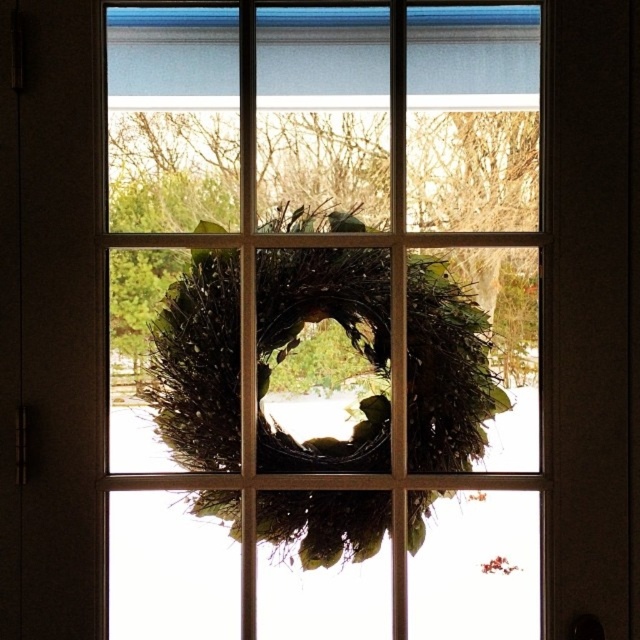
Question: Is green twig wreath at center bigger than green textured wreath at center?

Choices:
 (A) yes
 (B) no

Answer: (A)

Question: Does green twig wreath at center appear on the left side of green textured wreath at center?

Choices:
 (A) yes
 (B) no

Answer: (B)

Question: Is green twig wreath at center thinner than green textured wreath at center?

Choices:
 (A) yes
 (B) no

Answer: (B)

Question: Among these points, which one is nearest to the camera?

Choices:
 (A) (412, 547)
 (B) (516, 547)

Answer: (B)